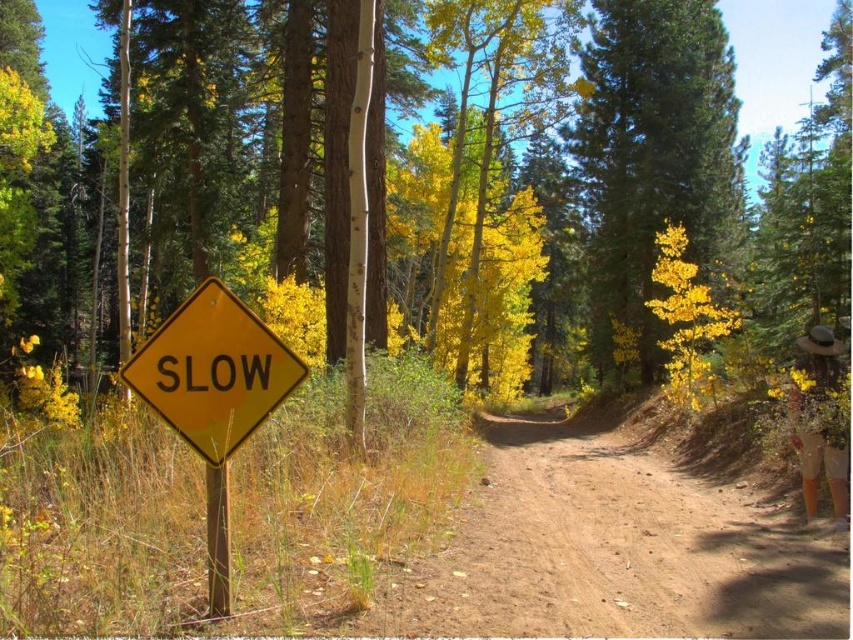
Question: Can you confirm if brown dirt track at center is smaller than yellow-green leaves at center?

Choices:
 (A) yes
 (B) no

Answer: (A)

Question: Can you confirm if yellow matte diamond at center is positioned to the right of yellow-green leaves at center?

Choices:
 (A) yes
 (B) no

Answer: (A)

Question: Which of the following is the farthest from the observer?

Choices:
 (A) yellow matte diamond at center
 (B) yellow-green leaves at center
 (C) yellow-green foliage at center

Answer: (B)

Question: Which object appears closest to the camera in this image?

Choices:
 (A) yellow-green leaves at center
 (B) yellow matte diamond at center

Answer: (B)

Question: Does yellow-green foliage at center appear over yellow matte diamond at center?

Choices:
 (A) yes
 (B) no

Answer: (A)

Question: Which point is closer to the camera taking this photo?

Choices:
 (A) (619, 145)
 (B) (500, 538)

Answer: (B)